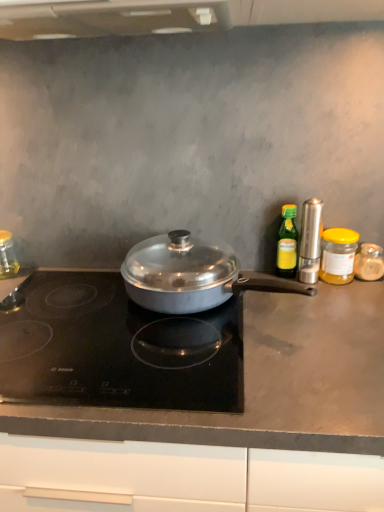
This screenshot has height=512, width=384. Identify the location of vacant area that is situated to the right of clear glass jar at left, the sixth kitchen appliance in the right-to-left sequence. (49, 278).